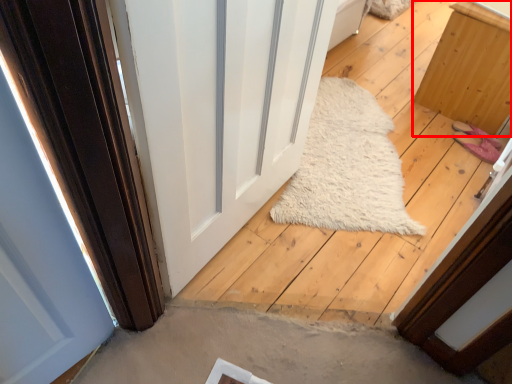
Question: From the image's perspective, where is furniture (annotated by the red box) located relative to door?

Choices:
 (A) above
 (B) below

Answer: (A)